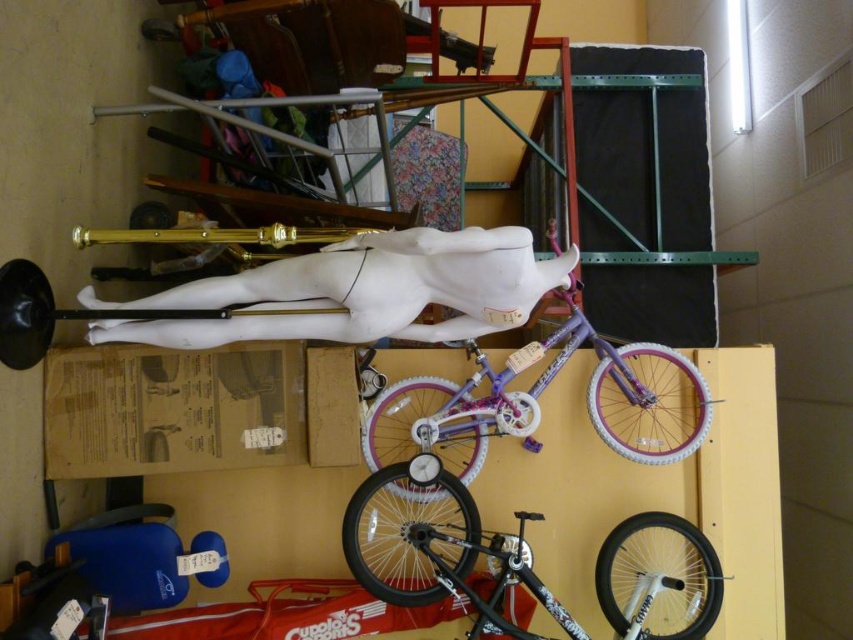
Question: Which object is the closest to the white marble statue at center?

Choices:
 (A) purple glossy bicycle at center
 (B) shiny black bicycle at center

Answer: (A)

Question: Is white marble statue at center to the right of shiny black bicycle at center from the viewer's perspective?

Choices:
 (A) yes
 (B) no

Answer: (B)

Question: Which point is farther to the camera?

Choices:
 (A) (410, 516)
 (B) (625, 410)

Answer: (B)

Question: Which of the following is the closest to the observer?

Choices:
 (A) white marble statue at center
 (B) purple glossy bicycle at center

Answer: (A)

Question: Does white marble statue at center have a lesser width compared to purple glossy bicycle at center?

Choices:
 (A) no
 (B) yes

Answer: (A)

Question: Is white marble statue at center further to the viewer compared to purple glossy bicycle at center?

Choices:
 (A) yes
 (B) no

Answer: (B)